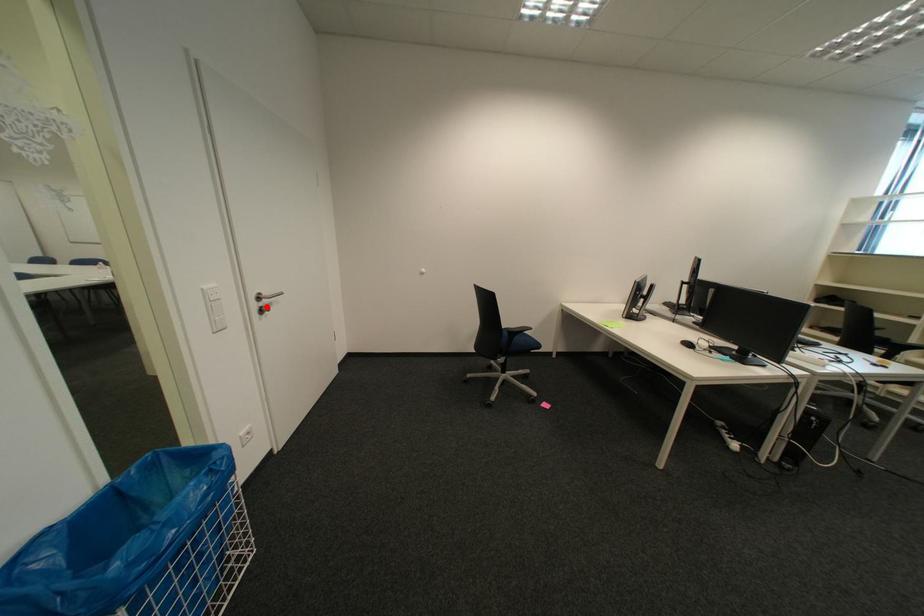
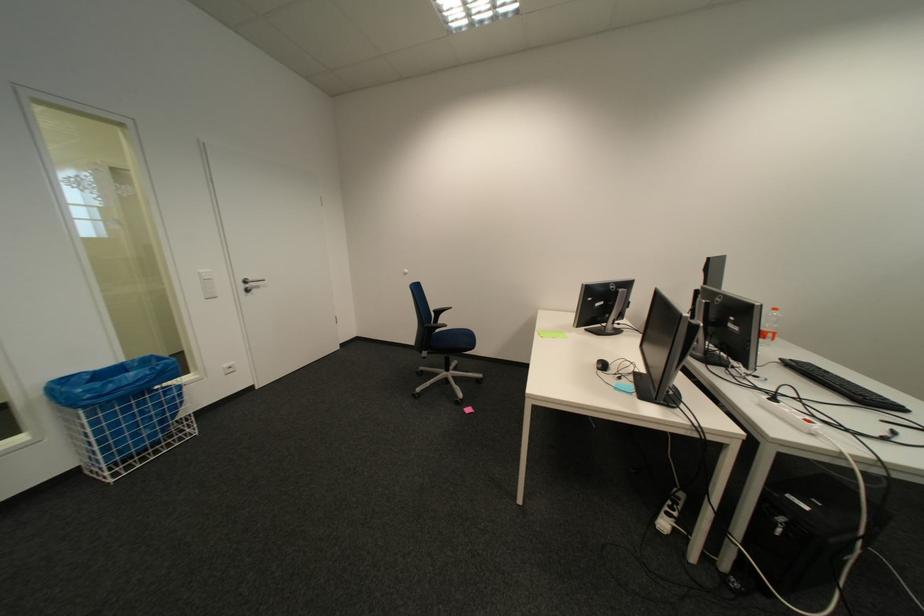
Locate, in the second image, the point that corresponds to the highlighted location in the first image.

(254, 286)